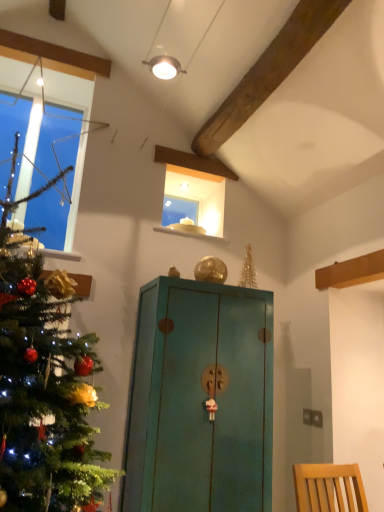
Question: Is teal painted wood cabinet at center to the left or to the right of clear glass window at left in the image?

Choices:
 (A) right
 (B) left

Answer: (A)

Question: Is teal painted wood cabinet at center spatially inside clear glass window at left, or outside of it?

Choices:
 (A) inside
 (B) outside

Answer: (B)

Question: Is teal painted wood cabinet at center taller or shorter than clear glass window at left?

Choices:
 (A) short
 (B) tall

Answer: (B)

Question: Considering their positions, is clear glass window at left located in front of or behind teal painted wood cabinet at center?

Choices:
 (A) front
 (B) behind

Answer: (B)

Question: Would you say clear glass window at left is inside or outside teal painted wood cabinet at center?

Choices:
 (A) inside
 (B) outside

Answer: (B)

Question: Considering the positions of clear glass window at left and teal painted wood cabinet at center in the image, is clear glass window at left taller or shorter than teal painted wood cabinet at center?

Choices:
 (A) tall
 (B) short

Answer: (B)

Question: Is clear glass window at left bigger or smaller than teal painted wood cabinet at center?

Choices:
 (A) small
 (B) big

Answer: (A)